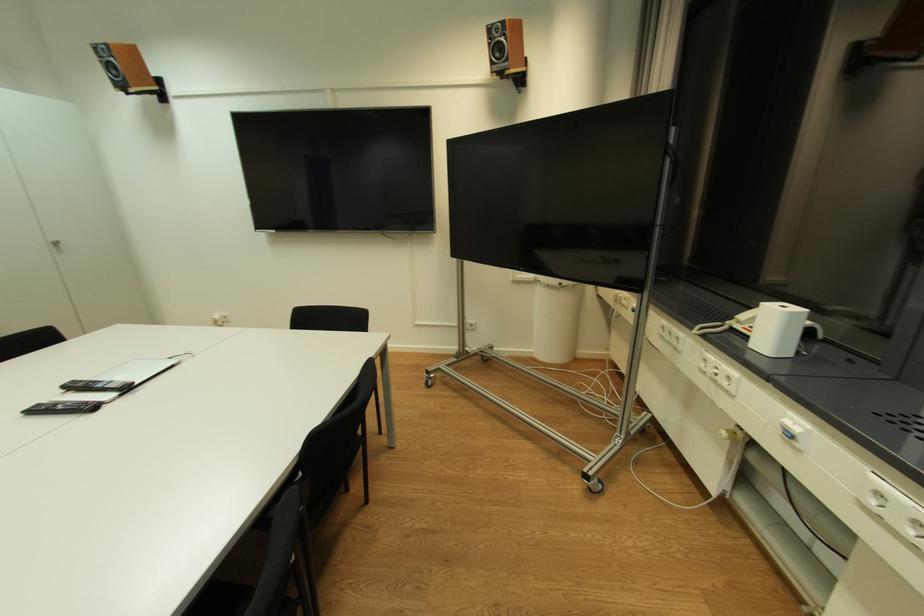
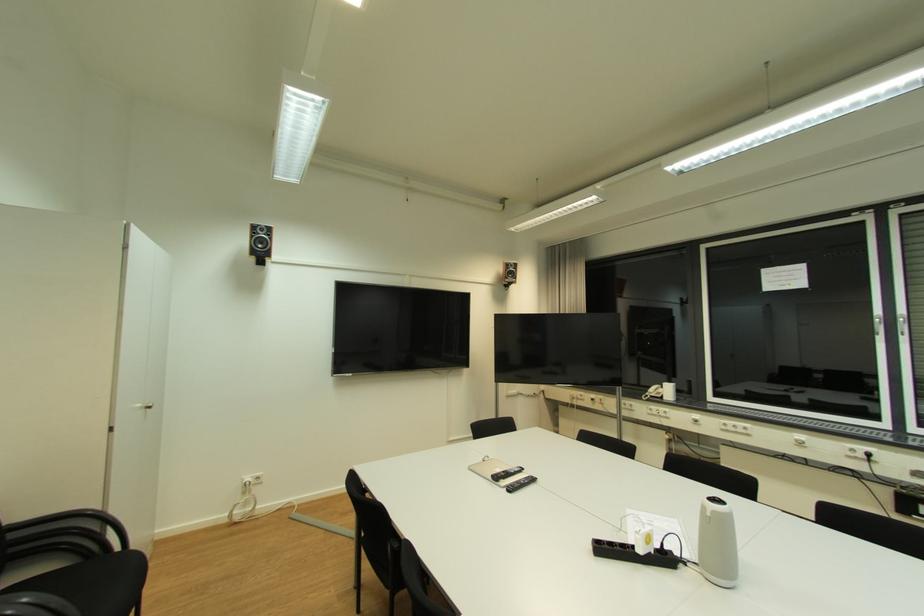
Locate, in the second image, the point that corresponds to the point at 738,330 in the first image.

(657, 397)